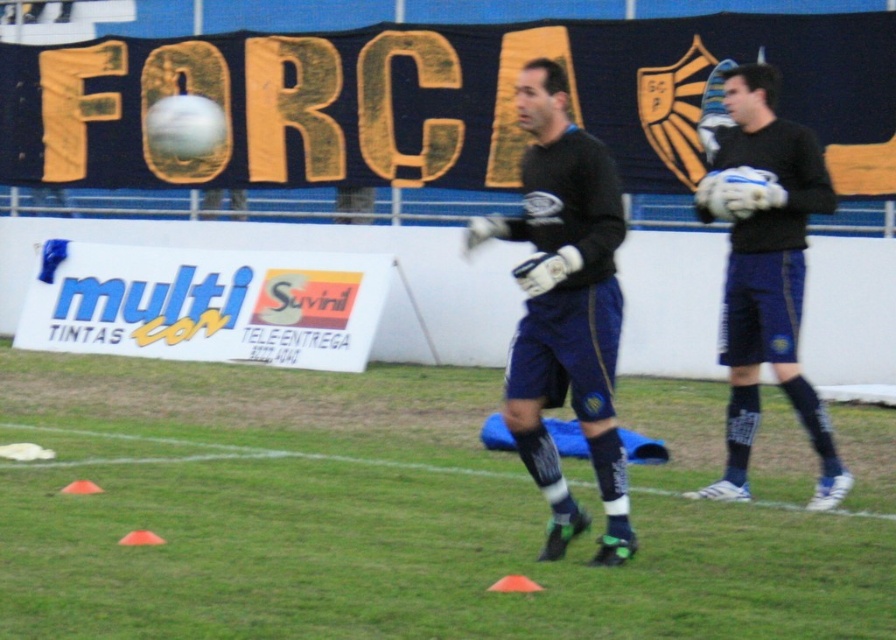
Question: Can you confirm if dark blue jersey at center is positioned to the right of matte black gloves at right?

Choices:
 (A) yes
 (B) no

Answer: (B)

Question: Is green grass at center positioned in front of matte black gloves at right?

Choices:
 (A) yes
 (B) no

Answer: (A)

Question: Which point is closer to the camera?

Choices:
 (A) green grass at center
 (B) dark blue jersey at center
 (C) matte black gloves at right

Answer: (A)

Question: Does green grass at center appear under dark blue jersey at center?

Choices:
 (A) yes
 (B) no

Answer: (A)

Question: Which point is closer to the camera?

Choices:
 (A) (567, 516)
 (B) (768, 332)

Answer: (A)

Question: Which point is closer to the camera taking this photo?

Choices:
 (A) (694, 481)
 (B) (791, 148)

Answer: (B)